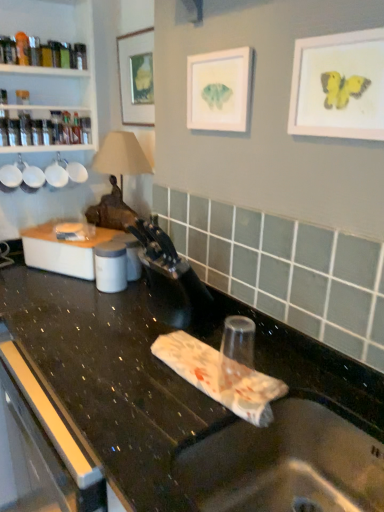
Identify the location of white glossy shelves at upper left. (52, 68).

Measure the distance between white plastic container at left and camera.

The depth of white plastic container at left is 1.50 meters.

The width and height of the screenshot is (384, 512). Find the location of `metallic stainless steel sink at lower center`. metallic stainless steel sink at lower center is located at coordinates (285, 461).

Measure the distance between point (375,448) and camera.

The distance of point (375,448) from camera is 34.80 inches.

What are the coordinates of `matte paper picture frame at center, marked as the second picture frame in a front-to-back arrangement` in the screenshot? It's located at (219, 90).

Which object is further away from the camera taking this photo, white glossy shelves at upper left or matte white picture frame at upper center, the third picture frame viewed from the front?

matte white picture frame at upper center, the third picture frame viewed from the front.

How far apart are white glossy shelves at upper left and matte white picture frame at upper center, the first picture frame positioned from the left?

10.97 inches.

Does point (41, 98) come farther from viewer compared to point (120, 36)?

Yes, point (41, 98) is farther from viewer.

Does white glossy shelves at upper left turn towards matte white picture frame at upper center, the 3th picture frame viewed from the right?

No, white glossy shelves at upper left is not facing towards matte white picture frame at upper center, the 3th picture frame viewed from the right.

Consider the image. Is black plastic faucet at center positioned behind matte white picture frame at upper center, the first picture frame positioned from the left?

No, black plastic faucet at center is closer to the viewer.

Is black plastic faucet at center bigger or smaller than matte white picture frame at upper center, the third picture frame viewed from the front?

Considering their sizes, black plastic faucet at center takes up more space than matte white picture frame at upper center, the third picture frame viewed from the front.

Could you tell me if black plastic faucet at center is facing matte white picture frame at upper center, the third picture frame viewed from the front?

No, black plastic faucet at center is not oriented towards matte white picture frame at upper center, the third picture frame viewed from the front.

Is black plastic faucet at center far from matte white picture frame at upper center, the 3th picture frame viewed from the right?

No, black plastic faucet at center is not far away from matte white picture frame at upper center, the 3th picture frame viewed from the right.

Between metallic stainless steel sink at lower center and black plastic faucet at center, which one has larger size?

metallic stainless steel sink at lower center.

From a real-world perspective, is metallic stainless steel sink at lower center over black plastic faucet at center?

No, from a real-world perspective, metallic stainless steel sink at lower center is not on top of black plastic faucet at center.

This screenshot has height=512, width=384. I want to click on faucet that appears above the metallic stainless steel sink at lower center (from a real-world perspective), so click(x=169, y=278).

Is metallic stainless steel sink at lower center not within black plastic faucet at center?

Yes, metallic stainless steel sink at lower center is located beyond the bounds of black plastic faucet at center.

Based on the photo, can you tell me how much black granite countertop at center and white plastic container at left differ in facing direction?

They differ by 28.8 degrees in their facing directions.

In the image, is black granite countertop at center on the left side or the right side of white plastic container at left?

Clearly, black granite countertop at center is on the right of white plastic container at left in the image.

Looking at this image, does black granite countertop at center turn towards white plastic container at left?

No, black granite countertop at center is not oriented towards white plastic container at left.

Consider the image. From their relative heights in the image, would you say black granite countertop at center is taller or shorter than white plastic container at left?

Considering their sizes, black granite countertop at center has more height than white plastic container at left.

Can you confirm if matte paper picture frame at center, which appears as the second picture frame when viewed from the right, is shorter than white plastic container at left?

Incorrect, the height of matte paper picture frame at center, which appears as the second picture frame when viewed from the right, does not fall short of that of white plastic container at left.

Can you confirm if matte paper picture frame at center, marked as the second picture frame in a front-to-back arrangement, is positioned to the right of white plastic container at left?

Indeed, matte paper picture frame at center, marked as the second picture frame in a front-to-back arrangement, is positioned on the right side of white plastic container at left.

Where is `appliance located below the matte paper picture frame at center, which appears as the second picture frame when viewed from the right (from the image's perspective)`? appliance located below the matte paper picture frame at center, which appears as the second picture frame when viewed from the right (from the image's perspective) is located at coordinates (62, 251).

Which of these two, matte paper picture frame at center, arranged as the second picture frame when viewed from the left, or white plastic container at left, is thinner?

With smaller width is matte paper picture frame at center, arranged as the second picture frame when viewed from the left.

Which object is more forward, black plastic faucet at center or white glossy shelves at upper left?

black plastic faucet at center is in front.

From a real-world perspective, which is physically below, black plastic faucet at center or white glossy shelves at upper left?

black plastic faucet at center is physically lower.

Considering the sizes of black plastic faucet at center and white glossy shelves at upper left in the image, is black plastic faucet at center wider or thinner than white glossy shelves at upper left?

In the image, black plastic faucet at center appears to be more narrow than white glossy shelves at upper left.

Considering the sizes of objects black plastic faucet at center and white glossy shelves at upper left in the image provided, who is taller, black plastic faucet at center or white glossy shelves at upper left?

white glossy shelves at upper left.

Can you confirm if black granite countertop at center is bigger than white glossy shelves at upper left?

Yes, black granite countertop at center is bigger than white glossy shelves at upper left.

Can you confirm if black granite countertop at center is shorter than white glossy shelves at upper left?

Incorrect, the height of black granite countertop at center does not fall short of that of white glossy shelves at upper left.

In the scene shown: Is black granite countertop at center positioned beyond the bounds of white glossy shelves at upper left?

Yes.

Find the location of `countertop directly beneath the white glossy shelves at upper left (from a real-world perspective)`. countertop directly beneath the white glossy shelves at upper left (from a real-world perspective) is located at coordinates (199, 404).

You are a GUI agent. You are given a task and a screenshot of the screen. Output one action in this format:
    pyautogui.click(x=<x>, y=<y>)
    Task: Click on the shelf to the left of matte white picture frame at upper center, the 3th picture frame viewed from the right
    
    Given the screenshot: What is the action you would take?
    pyautogui.click(x=52, y=68)

From a real-world perspective, starting from the black plastic faucet at center, which picture frame is the 3rd one vertically above it? Please provide its 2D coordinates.

[(136, 77)]

Based on their spatial positions, is white plastic container at left or matte white picture frame at upper center, the 3th picture frame viewed from the right, further from matte paper picture frame at center, marked as the second picture frame in a front-to-back arrangement?

white plastic container at left lies further to matte paper picture frame at center, marked as the second picture frame in a front-to-back arrangement, than the other object.

Looking at this image, based on their spatial positions, is metallic stainless steel sink at lower center or white plastic container at left closer to black granite countertop at center?

metallic stainless steel sink at lower center is closer to black granite countertop at center.

Estimate the real-world distances between objects in this image. Which object is closer to matte white picture frame at upper center, positioned as the 1th picture frame in back-to-front order, matte yellow butterfly at upper right, positioned as the 3th picture frame in back-to-front order, or black plastic faucet at center?

black plastic faucet at center.

Based on their spatial positions, is black plastic faucet at center or matte yellow butterfly at upper right, acting as the third picture frame starting from the left, closer to matte white picture frame at upper center, positioned as the 1th picture frame in back-to-front order?

Among the two, black plastic faucet at center is located nearer to matte white picture frame at upper center, positioned as the 1th picture frame in back-to-front order.

When comparing their distances from white plastic container at left, does matte white picture frame at upper center, positioned as the 1th picture frame in back-to-front order, or white glossy shelves at upper left seem closer?

Among the two, white glossy shelves at upper left is located nearer to white plastic container at left.

From the image, which object appears to be farther from black plastic faucet at center, matte yellow butterfly at upper right, which is the first picture frame from right to left, or matte paper picture frame at center, arranged as the second picture frame when viewed from the left?

The object further to black plastic faucet at center is matte yellow butterfly at upper right, which is the first picture frame from right to left.

Considering their positions, is black granite countertop at center positioned further to black plastic faucet at center than matte yellow butterfly at upper right, acting as the third picture frame starting from the left?

matte yellow butterfly at upper right, acting as the third picture frame starting from the left.

Looking at the image, which one is located further to metallic stainless steel sink at lower center, black plastic faucet at center or matte paper picture frame at center, marked as the second picture frame in a back-to-front arrangement?

matte paper picture frame at center, marked as the second picture frame in a back-to-front arrangement, is positioned further to the anchor metallic stainless steel sink at lower center.

Locate an element on the screen. Image resolution: width=384 pixels, height=512 pixels. picture frame between matte paper picture frame at center, marked as the second picture frame in a back-to-front arrangement, and metallic stainless steel sink at lower center vertically is located at coordinates (339, 86).

The image size is (384, 512). I want to click on shelf between matte white picture frame at upper center, positioned as the 1th picture frame in back-to-front order, and metallic stainless steel sink at lower center in the up-down direction, so click(x=52, y=68).

Locate an element on the screen. picture frame between white glossy shelves at upper left and matte paper picture frame at center, marked as the second picture frame in a back-to-front arrangement, from left to right is located at coordinates (136, 77).

Where is `faucet between white plastic container at left and matte paper picture frame at center, marked as the second picture frame in a front-to-back arrangement, in the horizontal direction`? The image size is (384, 512). faucet between white plastic container at left and matte paper picture frame at center, marked as the second picture frame in a front-to-back arrangement, in the horizontal direction is located at coordinates (169, 278).